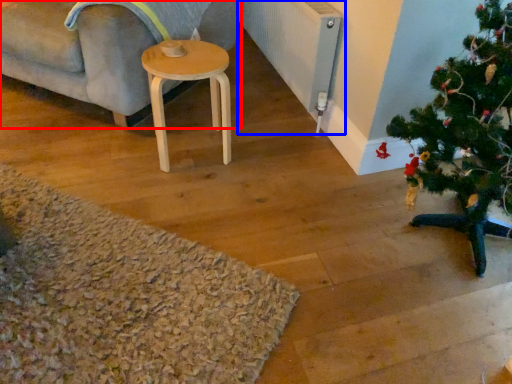
Question: Among these objects, which one is farthest to the camera, studio couch (highlighted by a red box) or radiator (highlighted by a blue box)?

Choices:
 (A) studio couch
 (B) radiator

Answer: (B)